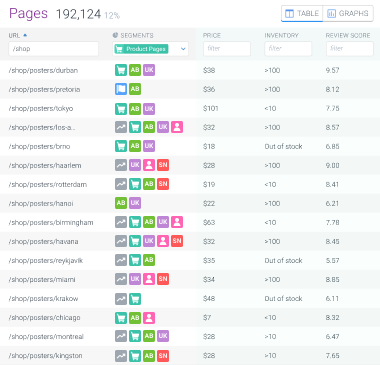
Locate an element on the screen. The image size is (380, 365). columns is located at coordinates (19, 36), (133, 34), (209, 34), (281, 33), (337, 36).